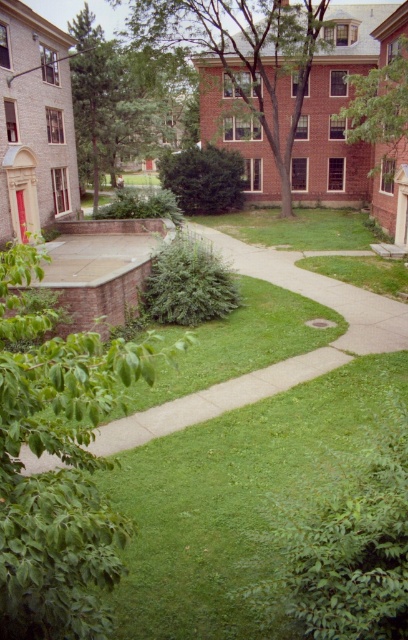
Question: Which point is farther from the camera taking this photo?

Choices:
 (A) (42, 460)
 (B) (397, 106)

Answer: (B)

Question: Which object is positioned closest to the green leafy tree at lower left?

Choices:
 (A) green leafy tree at center
 (B) green leafy tree at upper center

Answer: (B)

Question: Which object is closer to the camera taking this photo?

Choices:
 (A) green leafy tree at lower left
 (B) brown textured tree at upper center
 (C) green leafy tree at center
 (D) green leafy tree at upper center

Answer: (A)

Question: Is brown textured tree at upper center below green leafy tree at upper center?

Choices:
 (A) no
 (B) yes

Answer: (A)

Question: Does green leafy tree at lower left have a lesser width compared to brown textured tree at upper center?

Choices:
 (A) no
 (B) yes

Answer: (B)

Question: Does green leafy tree at lower left have a greater width compared to brown textured tree at upper center?

Choices:
 (A) no
 (B) yes

Answer: (A)